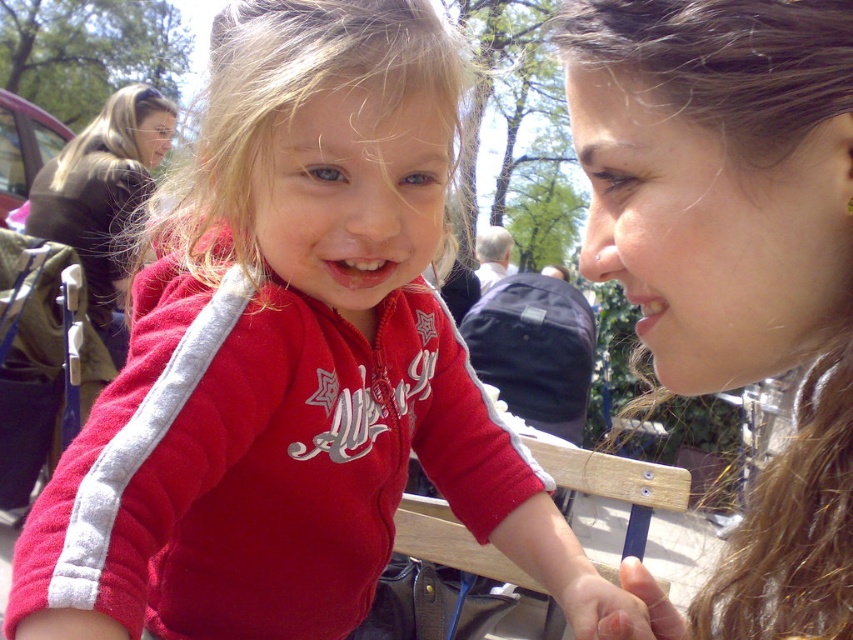
Question: Which object appears farthest from the camera in this image?

Choices:
 (A) brown leather jacket at upper left
 (B) matte skin face at upper left
 (C) matte red jacket at center
 (D) smooth skin face at upper right

Answer: (B)

Question: Which object is positioned farthest from the matte skin face at upper left?

Choices:
 (A) smooth skin face at upper right
 (B) smooth brown hair at center

Answer: (A)

Question: Is brown leather jacket at upper left to the left of matte skin face at upper left from the viewer's perspective?

Choices:
 (A) no
 (B) yes

Answer: (B)

Question: Does smooth brown hair at center appear on the left side of matte skin face at upper left?

Choices:
 (A) no
 (B) yes

Answer: (A)

Question: Is smooth brown hair at center bigger than matte red jacket at center?

Choices:
 (A) yes
 (B) no

Answer: (A)

Question: Which of the following is the closest to the observer?

Choices:
 (A) matte skin face at upper left
 (B) smooth brown hair at center
 (C) matte red jacket at center

Answer: (B)